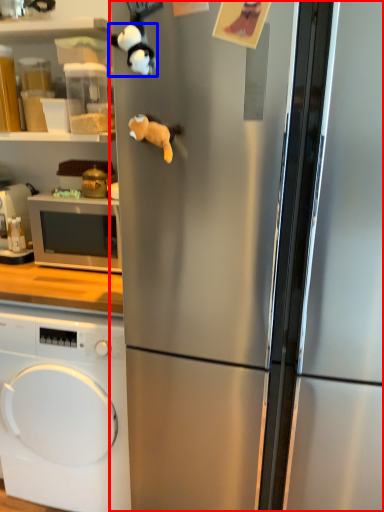
Question: Which point is further to the camera, refrigerator (highlighted by a red box) or animal (highlighted by a blue box)?

Choices:
 (A) refrigerator
 (B) animal

Answer: (B)